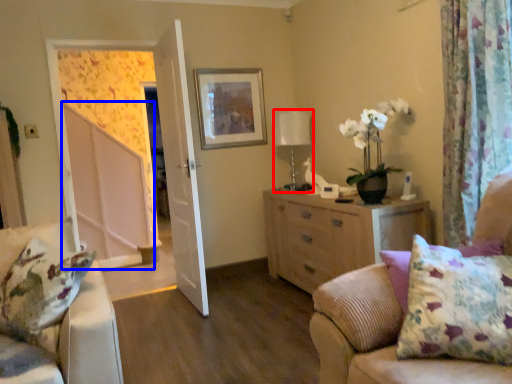
Question: Among these objects, which one is nearest to the camera, table lamp (highlighted by a red box) or screen door (highlighted by a blue box)?

Choices:
 (A) table lamp
 (B) screen door

Answer: (B)